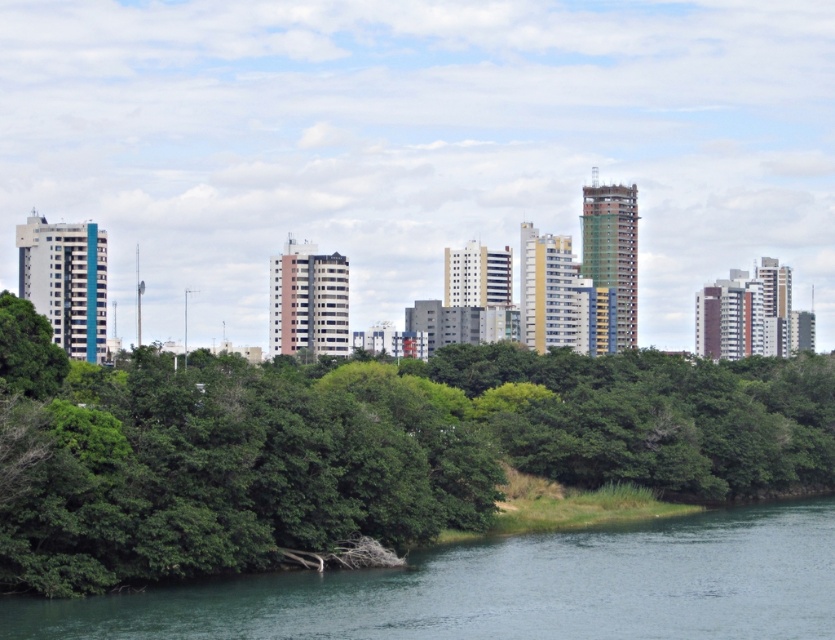
You are standing at the origin point of the image coordinate system. You want to walk towards the green leafy tree at center. Which direction should you move in terms of x and y coordinates?

Since the green leafy tree at center is located at point coordinates of 0.700 in the x direction and 0.434 in the y direction, you should move in the positive x and positive y directions to reach it.